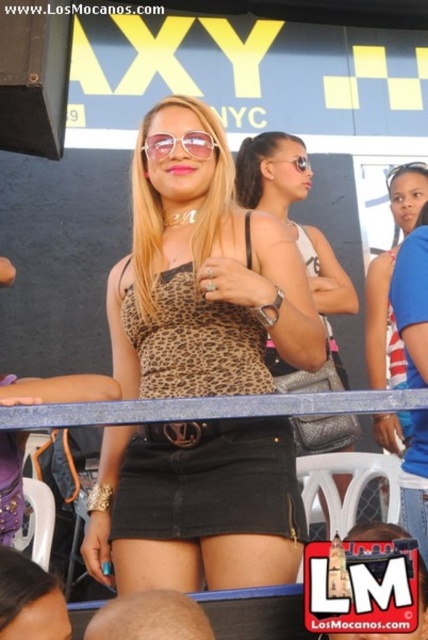
Consider the image. Looking at the woman in the center of the scene, which item is positioned to the left of the other between the leopard print tank top at center and the clear plastic goggles at center?

The leopard print tank top at center is positioned to the left of the clear plastic goggles at center.

You are a photographer at the event and need to capture a closeup of the woman. Which object between the dark brown hair at center and the clear plastic goggles at center will appear wider in the photo?

The clear plastic goggles at center will appear wider in the photo since it has a greater width compared to the dark brown hair at center.

You are a fashion designer analyzing the outfit of the central figure in the image. Which piece of clothing, the leopard print tank top at center or the black denim skirt at center, has a more prominent visual presence in the outfit?

The leopard print tank top at center has a larger size compared to the black denim skirt at center, making it the more prominent visual piece in the outfit.